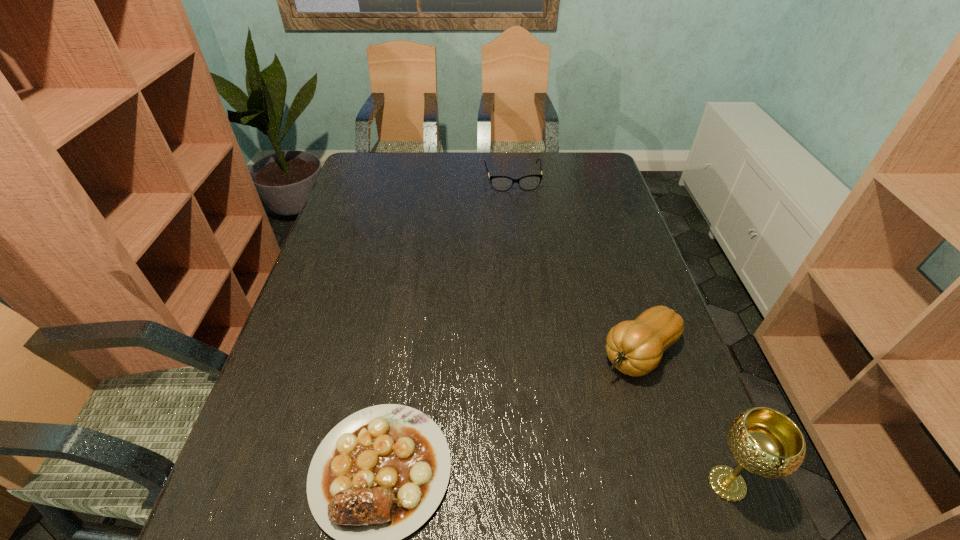
Find the location of `vacant space at the far right corner of the desktop`. vacant space at the far right corner of the desktop is located at coordinates (582, 154).

You are a GUI agent. You are given a task and a screenshot of the screen. Output one action in this format:
    pyautogui.click(x=<x>, y=<y>)
    Task: Click on the free spot at the near right corner of the desktop
    This screenshot has width=960, height=540.
    Given the screenshot: What is the action you would take?
    pyautogui.click(x=643, y=470)

The image size is (960, 540). Find the location of `vacant space that's between the second farthest object and the spectacles`. vacant space that's between the second farthest object and the spectacles is located at coordinates (576, 266).

You are a GUI agent. You are given a task and a screenshot of the screen. Output one action in this format:
    pyautogui.click(x=<x>, y=<y>)
    Task: Click on the vacant area that lies between the spectacles and the second farthest object
    This screenshot has height=540, width=960.
    Given the screenshot: What is the action you would take?
    point(576,266)

You are a GUI agent. You are given a task and a screenshot of the screen. Output one action in this format:
    pyautogui.click(x=<x>, y=<y>)
    Task: Click on the free area in between the second farthest object and the tallest object
    This screenshot has width=960, height=540.
    Given the screenshot: What is the action you would take?
    pyautogui.click(x=684, y=418)

Where is `free point between the chalice and the gourd`? The width and height of the screenshot is (960, 540). free point between the chalice and the gourd is located at coordinates (684, 418).

You are a GUI agent. You are given a task and a screenshot of the screen. Output one action in this format:
    pyautogui.click(x=<x>, y=<y>)
    Task: Click on the object that is the third nearest to the second tallest object
    
    Given the screenshot: What is the action you would take?
    pyautogui.click(x=530, y=182)

Identify the location of object identified as the second closest to the second tallest object. This screenshot has width=960, height=540. (378, 475).

I want to click on free location that satisfies the following two spatial constraints: 1. on the front side of the chalice; 2. on the right side of the second object from left to right, so click(x=541, y=483).

The height and width of the screenshot is (540, 960). I want to click on free region that satisfies the following two spatial constraints: 1. on the front side of the tallest object; 2. on the left side of the second tallest object, so click(x=682, y=483).